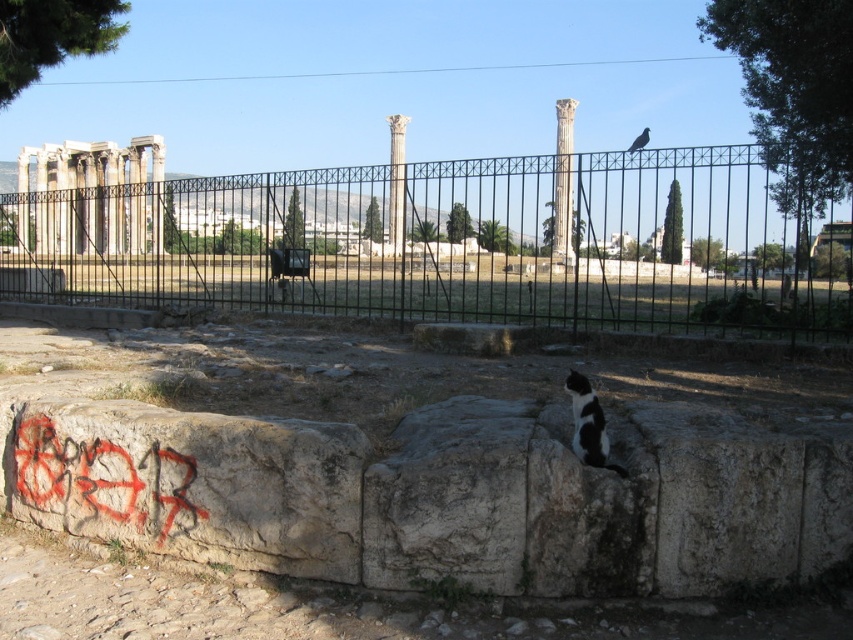
Which is more to the right, black metal fence at center or smooth white column at center?

smooth white column at center

Which is more to the left, black metal fence at center or smooth white column at center?

From the viewer's perspective, black metal fence at center appears more on the left side.

Locate an element on the screen. The image size is (853, 640). black metal fence at center is located at coordinates (457, 243).

Image resolution: width=853 pixels, height=640 pixels. What are the coordinates of `black metal fence at center` in the screenshot? It's located at (457, 243).

Is black and white fur cat at center to the right of smooth stone column at center from the viewer's perspective?

Indeed, black and white fur cat at center is positioned on the right side of smooth stone column at center.

At what (x,y) coordinates should I click in order to perform the action: click on black and white fur cat at center. Please return your answer as a coordinate pair (x, y). This screenshot has width=853, height=640. Looking at the image, I should click on (589, 424).

Does black metal fence at center have a greater height compared to white marble columns at left?

Correct, black metal fence at center is much taller as white marble columns at left.

Does black metal fence at center lie behind white marble columns at left?

No, black metal fence at center is in front of white marble columns at left.

Find the location of a particular element. This screenshot has height=640, width=853. black metal fence at center is located at coordinates (457, 243).

Image resolution: width=853 pixels, height=640 pixels. What are the coordinates of `black metal fence at center` in the screenshot? It's located at (457, 243).